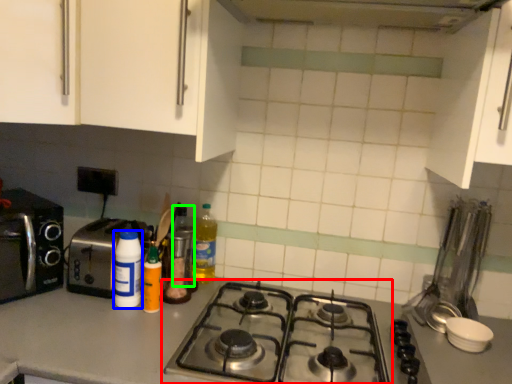
Question: Estimate the real-world distances between objects in this image. Which object is closer to gas stove (highlighted by a red box), bottle (highlighted by a blue box) or bottle (highlighted by a green box)?

Choices:
 (A) bottle
 (B) bottle

Answer: (B)